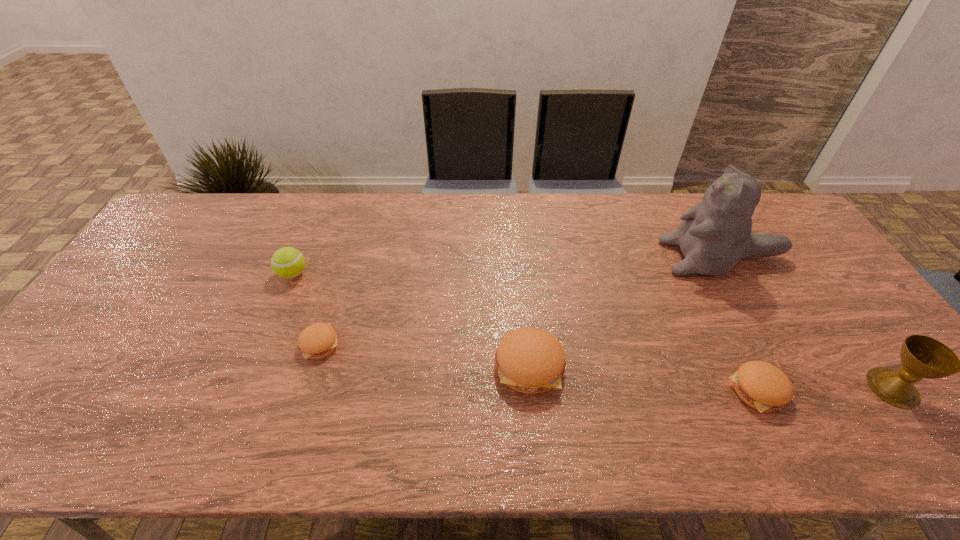
At what (x,y) coordinates should I click in order to perform the action: click on vacant space located 0.230m on the left of the third object from left to right. Please return your answer as a coordinate pair (x, y). Looking at the image, I should click on (402, 366).

You are a GUI agent. You are given a task and a screenshot of the screen. Output one action in this format:
    pyautogui.click(x=<x>, y=<y>)
    Task: Click on the free space located on the back of the second shortest patty
    The image size is (960, 540).
    Given the screenshot: What is the action you would take?
    pyautogui.click(x=720, y=313)

Where is `vacant region located 0.070m on the face of the cat`? vacant region located 0.070m on the face of the cat is located at coordinates (641, 257).

The image size is (960, 540). I want to click on free spot located 0.350m on the face of the cat, so click(x=551, y=257).

At what (x,y) coordinates should I click in order to perform the action: click on vacant space located 0.100m on the face of the cat. Please return your answer as a coordinate pair (x, y). The height and width of the screenshot is (540, 960). Looking at the image, I should click on (632, 257).

Where is `free space located 0.080m on the back of the tennis ball`? free space located 0.080m on the back of the tennis ball is located at coordinates (304, 246).

The width and height of the screenshot is (960, 540). What are the coordinates of `vacant area situated on the back of the chalice` in the screenshot? It's located at (856, 338).

Image resolution: width=960 pixels, height=540 pixels. What are the coordinates of `object at the far edge` in the screenshot? It's located at (715, 234).

The width and height of the screenshot is (960, 540). Identify the location of chalice present at the near edge. (922, 357).

Locate an element on the screen. Image resolution: width=960 pixels, height=540 pixels. cat present at the right edge is located at coordinates (715, 234).